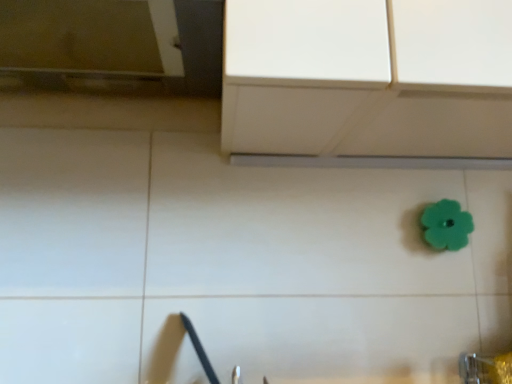
Question: From their relative heights in the image, would you say metallic silver faucet at lower right is taller or shorter than teal rubber flower at center-right?

Choices:
 (A) tall
 (B) short

Answer: (A)

Question: Is metallic silver faucet at lower right in front of or behind teal rubber flower at center-right in the image?

Choices:
 (A) behind
 (B) front

Answer: (B)

Question: Looking at the image, does metallic silver faucet at lower right seem bigger or smaller compared to teal rubber flower at center-right?

Choices:
 (A) small
 (B) big

Answer: (B)

Question: Considering the relative positions of teal rubber flower at center-right and metallic silver faucet at lower right in the image provided, is teal rubber flower at center-right to the left or to the right of metallic silver faucet at lower right?

Choices:
 (A) left
 (B) right

Answer: (B)

Question: Considering the positions of point (442, 228) and point (465, 369), is point (442, 228) closer or farther from the camera than point (465, 369)?

Choices:
 (A) farther
 (B) closer

Answer: (A)

Question: Considering their positions, is teal rubber flower at center-right located in front of or behind metallic silver faucet at lower right?

Choices:
 (A) behind
 (B) front

Answer: (A)

Question: Is teal rubber flower at center-right spatially inside metallic silver faucet at lower right, or outside of it?

Choices:
 (A) outside
 (B) inside

Answer: (A)